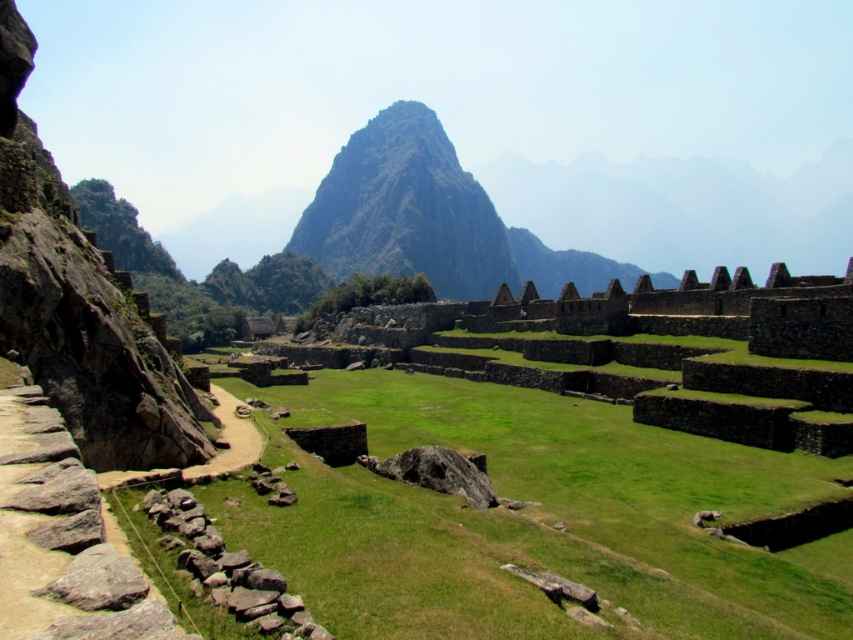
Question: Is green grassy at center thinner than brown rough stone wall at lower left?

Choices:
 (A) no
 (B) yes

Answer: (A)

Question: Is green grassy at center closer to the viewer compared to green rocky mountain at center?

Choices:
 (A) yes
 (B) no

Answer: (A)

Question: Which point is closer to the camera taking this photo?

Choices:
 (A) (294, 624)
 (B) (431, 163)
 (C) (795, 577)

Answer: (A)

Question: Is green grassy at center closer to camera compared to brown rough stone wall at lower left?

Choices:
 (A) no
 (B) yes

Answer: (A)

Question: Among these points, which one is farthest from the camera?

Choices:
 (A) (270, 609)
 (B) (380, 618)
 (C) (366, 125)

Answer: (C)

Question: Among these points, which one is farthest from the camera?

Choices:
 (A) (413, 125)
 (B) (352, 474)

Answer: (A)